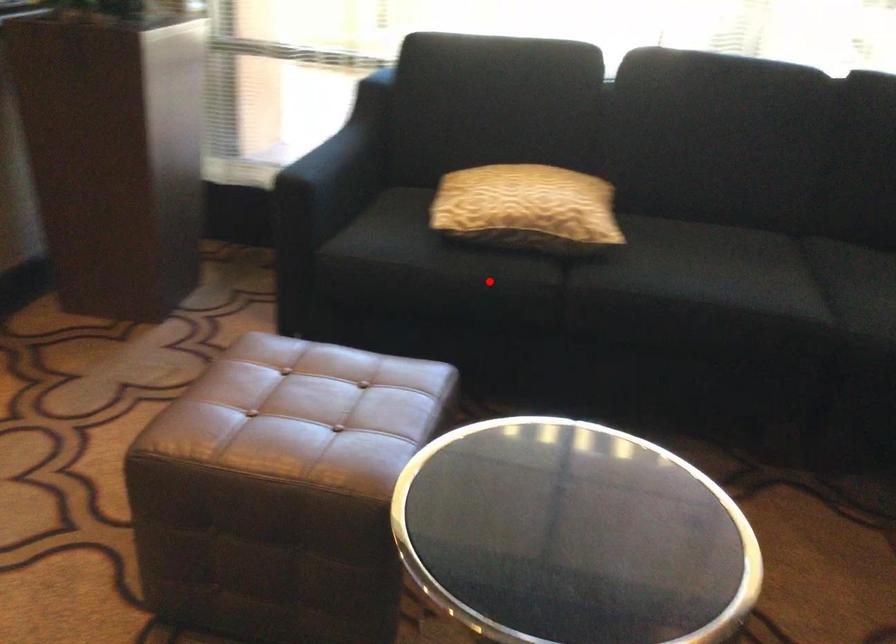
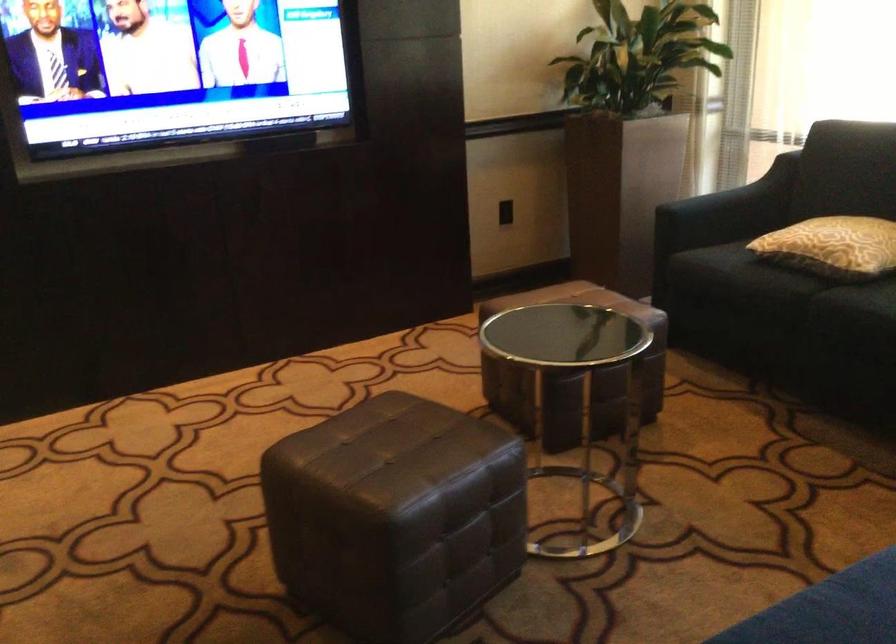
The point at the highlighted location is marked in the first image. Where is the corresponding point in the second image?

(767, 283)